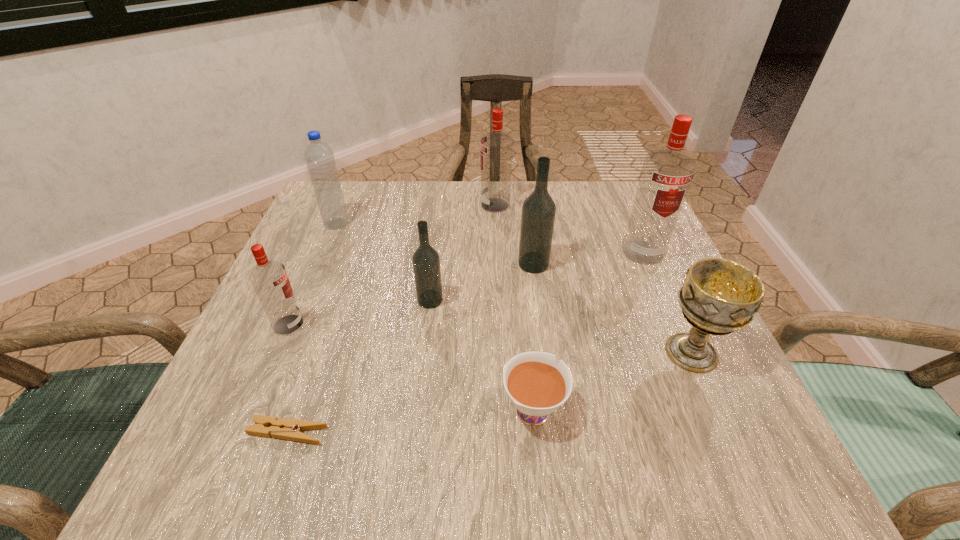
Locate an element on the screen. vacant space located 0.370m on the front label of the farthest vodka is located at coordinates (331, 205).

The image size is (960, 540). I want to click on free spot located on the back of the water bottle, so click(352, 184).

Identify the location of free location located on the front label of the smallest red vodka. point(513,325).

Where is `vacant space located 0.370m on the right of the smaller black vodka`? The image size is (960, 540). vacant space located 0.370m on the right of the smaller black vodka is located at coordinates (635, 300).

Where is `vacant space positioned 0.070m on the left of the chalice`? Image resolution: width=960 pixels, height=540 pixels. vacant space positioned 0.070m on the left of the chalice is located at coordinates (618, 353).

The width and height of the screenshot is (960, 540). What are the coordinates of `vacant space situated on the side of the teacup with the handle` in the screenshot? It's located at (516, 242).

Identify the location of vacant region located 0.390m on the side of the teacup with the handle. (516, 234).

You are a GUI agent. You are given a task and a screenshot of the screen. Output one action in this format:
    pyautogui.click(x=<x>, y=<y>)
    Task: Click on the vacant space located on the side of the teacup with the handle
    The image size is (960, 540).
    Given the screenshot: What is the action you would take?
    pyautogui.click(x=521, y=292)

This screenshot has height=540, width=960. In order to click on vacant area situated on the back of the clothespin in this screenshot , I will do `click(340, 284)`.

Where is `vodka that is at the far edge`? vodka that is at the far edge is located at coordinates (496, 147).